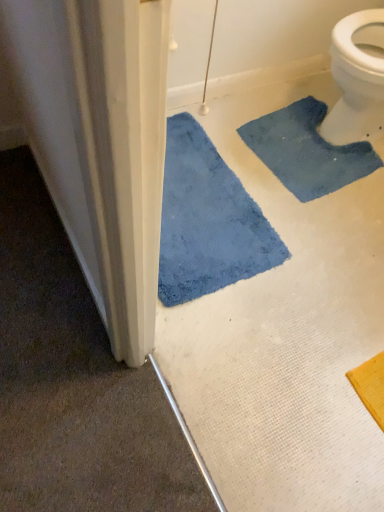
Question: Is blue plush bath mat at lower left, which ranks as the second bath mat in right-to-left order, inside or outside of blue fuzzy bath mat at upper right, the first bath mat from the right?

Choices:
 (A) inside
 (B) outside

Answer: (B)

Question: From the image's perspective, is blue plush bath mat at lower left, which is counted as the first bath mat, starting from the left, above or below blue fuzzy bath mat at upper right, the second bath mat in the left-to-right sequence?

Choices:
 (A) above
 (B) below

Answer: (B)

Question: In the image, is blue plush bath mat at lower left, which ranks as the second bath mat in right-to-left order, on the left side or the right side of blue fuzzy bath mat at upper right, the first bath mat from the right?

Choices:
 (A) left
 (B) right

Answer: (A)

Question: Looking at the image, does blue fuzzy bath mat at upper right, the second bath mat in the left-to-right sequence, seem bigger or smaller compared to blue plush bath mat at lower left, which is counted as the first bath mat, starting from the left?

Choices:
 (A) big
 (B) small

Answer: (B)

Question: From a real-world perspective, is blue fuzzy bath mat at upper right, the second bath mat in the left-to-right sequence, above or below blue plush bath mat at lower left, which ranks as the second bath mat in right-to-left order?

Choices:
 (A) below
 (B) above

Answer: (A)

Question: In terms of width, does blue fuzzy bath mat at upper right, the first bath mat from the right, look wider or thinner when compared to blue plush bath mat at lower left, which ranks as the second bath mat in right-to-left order?

Choices:
 (A) wide
 (B) thin

Answer: (B)

Question: From their relative heights in the image, would you say blue fuzzy bath mat at upper right, the first bath mat from the right, is taller or shorter than blue plush bath mat at lower left, which is counted as the first bath mat, starting from the left?

Choices:
 (A) short
 (B) tall

Answer: (A)